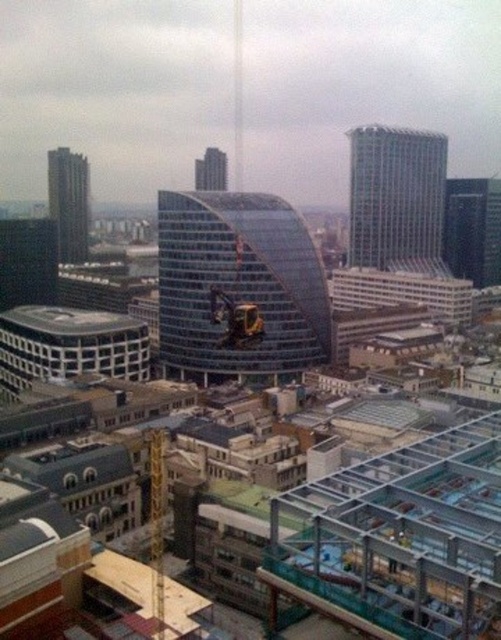
Question: Where is transparent glass building at center located in relation to yellow metallic crane at center in the image?

Choices:
 (A) below
 (B) above

Answer: (B)

Question: Does yellow metallic crane at center have a smaller size compared to glassy steel skyscraper at center?

Choices:
 (A) no
 (B) yes

Answer: (B)

Question: Can you confirm if dark gray glass skyscraper at right is smaller than glassy steel skyscraper at center?

Choices:
 (A) no
 (B) yes

Answer: (A)

Question: Among these points, which one is farthest from the camera?

Choices:
 (A) (x=75, y=170)
 (B) (x=154, y=504)

Answer: (A)

Question: Among these points, which one is nearest to the camera?

Choices:
 (A) (406, 241)
 (B) (475, 205)
 (C) (200, 163)

Answer: (A)

Question: Which of the following is the closest to the observer?

Choices:
 (A) yellow metallic crane at center
 (B) dark gray glass skyscraper at upper left

Answer: (A)